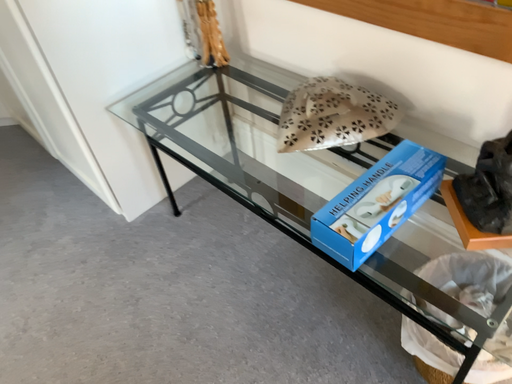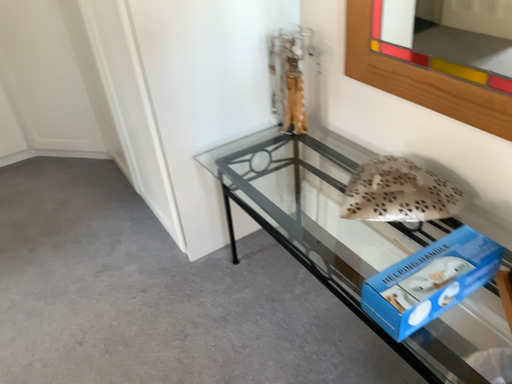
Question: Which way did the camera rotate in the video?

Choices:
 (A) rotated right
 (B) rotated left

Answer: (B)